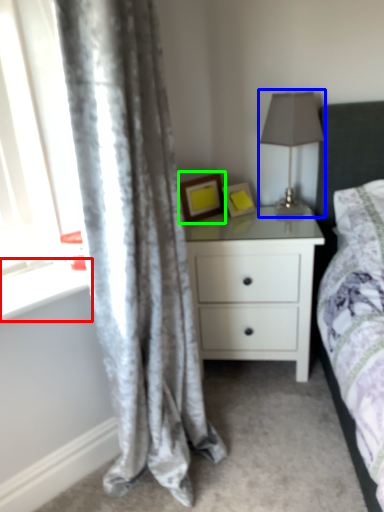
Question: Based on their relative distances, which object is nearer to window sill (highlighted by a red box)? Choose from table lamp (highlighted by a blue box) and picture frame (highlighted by a green box).

Choices:
 (A) table lamp
 (B) picture frame

Answer: (B)